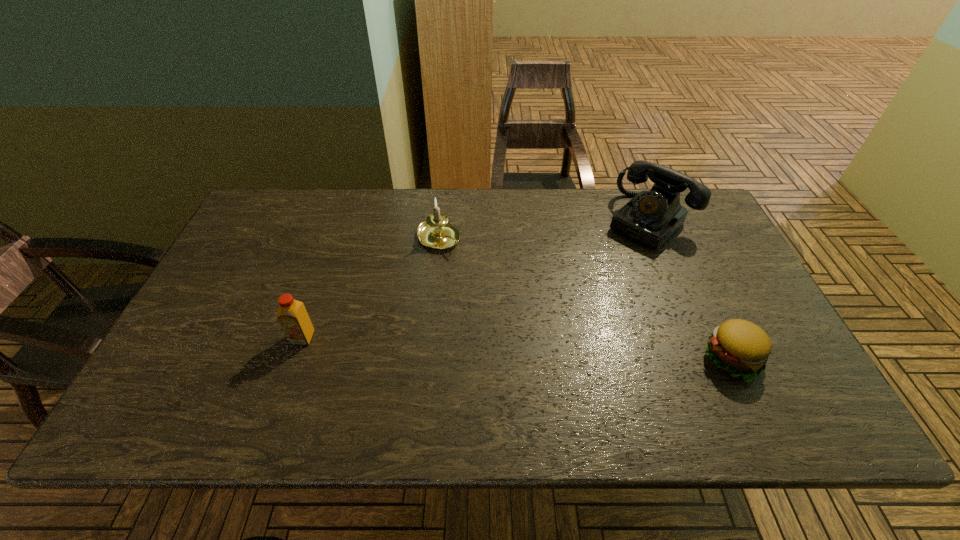
This screenshot has height=540, width=960. In order to click on free space between the second object from left to right and the tallest object in this screenshot , I will do `click(543, 230)`.

Find the location of a particular element. The height and width of the screenshot is (540, 960). free space between the leftmost object and the telephone is located at coordinates (475, 280).

Where is `free space between the second object from left to right and the orange juice`? free space between the second object from left to right and the orange juice is located at coordinates (371, 288).

This screenshot has height=540, width=960. Find the location of `empty space between the leftmost object and the hamburger`. empty space between the leftmost object and the hamburger is located at coordinates (518, 348).

Choose which object is the third nearest neighbor to the shortest object. Please provide its 2D coordinates. Your answer should be formatted as a tuple, i.e. [(x, y)], where the tuple contains the x and y coordinates of a point satisfying the conditions above.

[(292, 315)]

Identify which object is the second closest to the telephone. Please provide its 2D coordinates. Your answer should be formatted as a tuple, i.e. [(x, y)], where the tuple contains the x and y coordinates of a point satisfying the conditions above.

[(436, 232)]

Where is `free space that satisfies the following two spatial constraints: 1. on the back side of the telephone; 2. on the right side of the candle holder`? Image resolution: width=960 pixels, height=540 pixels. free space that satisfies the following two spatial constraints: 1. on the back side of the telephone; 2. on the right side of the candle holder is located at coordinates (441, 221).